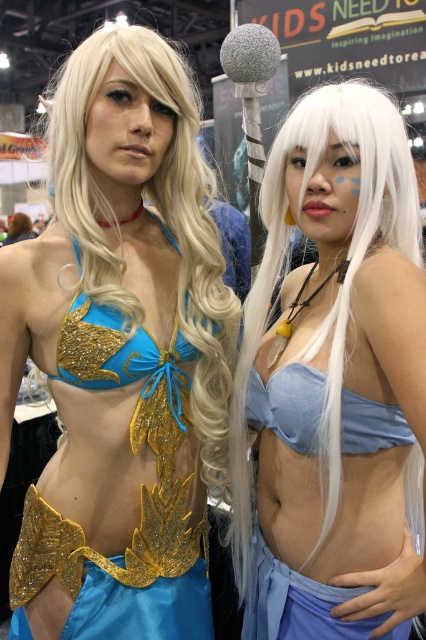
Does matte gold bikini top at center have a smaller size compared to matte blue bikini top at center?

Incorrect, matte gold bikini top at center is not smaller in size than matte blue bikini top at center.

Who is more distant from viewer, (104, 246) or (273, 602)?

Positioned behind is point (273, 602).

Locate an element on the screen. The width and height of the screenshot is (426, 640). matte gold bikini top at center is located at coordinates (120, 355).

Locate an element on the screen. Image resolution: width=426 pixels, height=640 pixels. matte gold bikini top at center is located at coordinates (120, 355).

Who is taller, matte blue bikini top at center or blue satin bikini top at center?

matte blue bikini top at center

This screenshot has height=640, width=426. I want to click on matte blue bikini top at center, so click(x=333, y=384).

Between matte gold bikini top at center and blue satin bikini top at center, which one is positioned higher?

Positioned higher is matte gold bikini top at center.

Which is more to the left, matte gold bikini top at center or blue satin bikini top at center?

matte gold bikini top at center

Who is more forward, (183, 72) or (336, 620)?

Point (336, 620) is more forward.

Identify the location of matte gold bikini top at center. (120, 355).